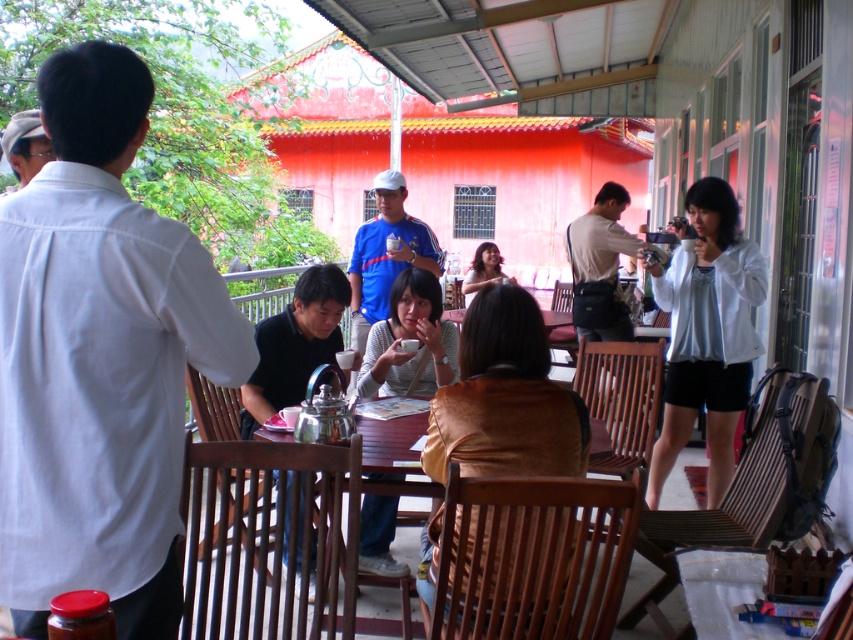
You are planning to place a large potted plant between the white matte jacket at right and the wooden table at center. Based on their widths, which object might require more space on the patio?

The white matte jacket at right might require more space on the patio since it might be wider than the wooden table at center according to the description.

You are standing at the entrance of the patio and want to greet the person in the white matte jacket at right. Which direction should you walk relative to the wooden table at center?

The white matte jacket at right is positioned on the right side of the wooden table at center, so you should walk to the right of the wooden table at center to reach the person.